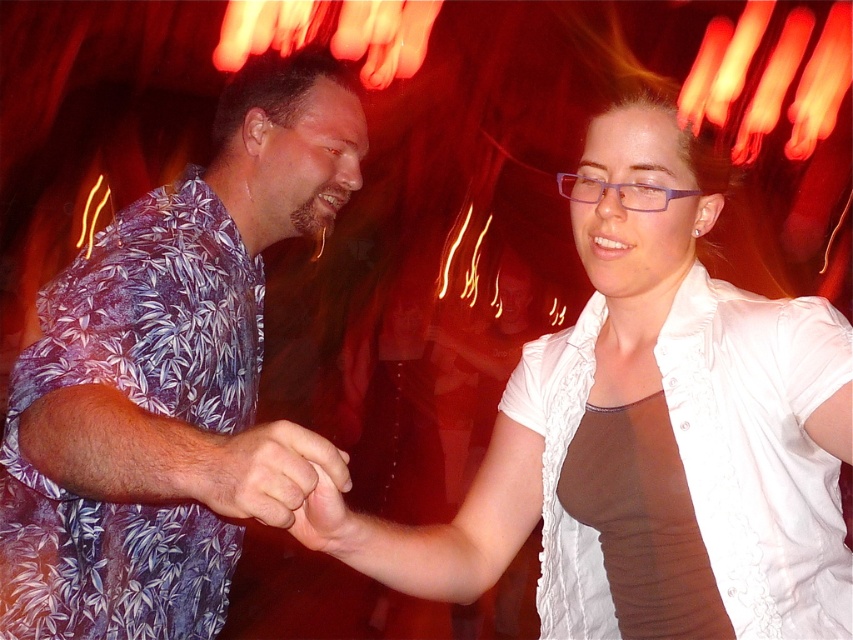
This screenshot has width=853, height=640. Find the location of `purple leaf-patterned shirt at left`. purple leaf-patterned shirt at left is located at coordinates (170, 378).

The image size is (853, 640). Describe the element at coordinates (170, 378) in the screenshot. I see `purple leaf-patterned shirt at left` at that location.

Where is `purple leaf-patterned shirt at left`? purple leaf-patterned shirt at left is located at coordinates (170, 378).

Can you confirm if white textured blouse at center is wider than matte floral shirt at center?

Indeed, white textured blouse at center has a greater width compared to matte floral shirt at center.

Consider the image. Who is shorter, white textured blouse at center or matte floral shirt at center?

matte floral shirt at center

Is point (669, 374) less distant than point (236, 435)?

No.

You are a GUI agent. You are given a task and a screenshot of the screen. Output one action in this format:
    pyautogui.click(x=<x>, y=<y>)
    Task: Click on the white textured blouse at center
    This screenshot has width=853, height=640.
    Given the screenshot: What is the action you would take?
    pyautogui.click(x=619, y=397)

Is purple leaf-patterned shirt at left taller than matte floral shirt at center?

Correct, purple leaf-patterned shirt at left is much taller as matte floral shirt at center.

Does point (88, 456) come in front of point (323, 461)?

No, it is behind (323, 461).

The image size is (853, 640). What do you see at coordinates (170, 378) in the screenshot?
I see `purple leaf-patterned shirt at left` at bounding box center [170, 378].

I want to click on purple leaf-patterned shirt at left, so click(170, 378).